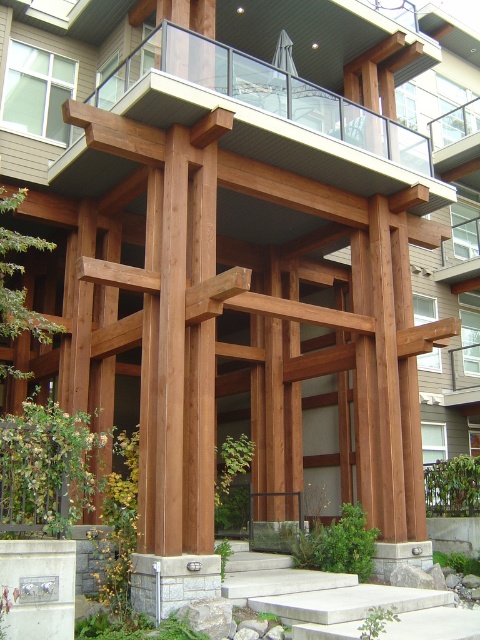
Who is positioned more to the right, wooden balcony at upper center or concrete at center?

From the viewer's perspective, concrete at center appears more on the right side.

Between wooden balcony at upper center and concrete at center, which one has more height?

Standing taller between the two is wooden balcony at upper center.

Between point (191, 112) and point (432, 589), which one is positioned behind?

The point (432, 589) is behind.

Find the location of a particular element. This screenshot has width=480, height=640. wooden balcony at upper center is located at coordinates (265, 108).